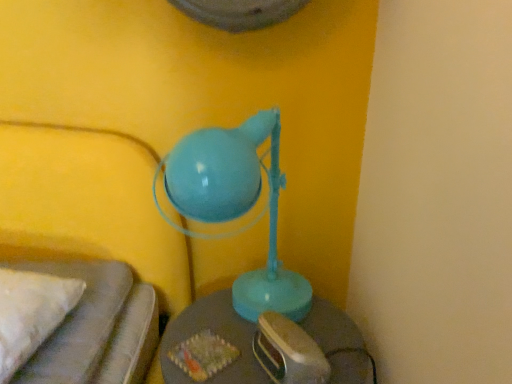
The width and height of the screenshot is (512, 384). Find the location of `matte blue lamp at center`. matte blue lamp at center is located at coordinates (234, 205).

What do you see at coordinates (234, 205) in the screenshot? The width and height of the screenshot is (512, 384). I see `matte blue lamp at center` at bounding box center [234, 205].

Image resolution: width=512 pixels, height=384 pixels. Describe the element at coordinates (211, 345) in the screenshot. I see `matte gray table at center` at that location.

At what (x,y) coordinates should I click in order to perform the action: click on matte gray table at center. Please return your answer as a coordinate pair (x, y). This screenshot has width=512, height=384. Looking at the image, I should click on (211, 345).

At what (x,y) coordinates should I click in order to perform the action: click on matte blue lamp at center. Please return your answer as a coordinate pair (x, y). This screenshot has width=512, height=384. Looking at the image, I should click on (234, 205).

Is matte blue lamp at center to the left of matte gray table at center from the viewer's perspective?

Yes.

Considering their positions, is matte blue lamp at center located in front of or behind matte gray table at center?

In the image, matte blue lamp at center appears in front of matte gray table at center.

Is point (234, 186) positioned before point (361, 382)?

Yes, it is in front of point (361, 382).

From the image's perspective, does matte blue lamp at center appear lower than matte gray table at center?

No.

From a real-world perspective, does matte blue lamp at center sit lower than matte gray table at center?

Actually, matte blue lamp at center is physically above matte gray table at center in the real world.

Consider the image. Is matte blue lamp at center wider than matte gray table at center?

Yes, matte blue lamp at center is wider than matte gray table at center.

Which of these two, matte blue lamp at center or matte gray table at center, stands shorter?

Standing shorter between the two is matte gray table at center.

In terms of size, does matte blue lamp at center appear bigger or smaller than matte gray table at center?

Considering their sizes, matte blue lamp at center takes up more space than matte gray table at center.

Looking at this image, is matte gray table at center located within matte blue lamp at center?

No, matte blue lamp at center does not contain matte gray table at center.

Is matte blue lamp at center far from matte gray table at center?

No, matte blue lamp at center is not far away from matte gray table at center.

Could you tell me if matte blue lamp at center is turned towards matte gray table at center?

No, matte blue lamp at center is not oriented towards matte gray table at center.

How different are the orientations of matte blue lamp at center and matte gray table at center in degrees?

The facing directions of matte blue lamp at center and matte gray table at center are 0.868 degrees apart.

Where is `lamp above the matte gray table at center (from a real-world perspective)`? lamp above the matte gray table at center (from a real-world perspective) is located at coordinates (234, 205).

Between matte gray table at center and matte blue lamp at center, which one appears on the right side from the viewer's perspective?

From the viewer's perspective, matte gray table at center appears more on the right side.

Considering the positions of objects matte gray table at center and matte blue lamp at center in the image provided, who is in front, matte gray table at center or matte blue lamp at center?

Positioned in front is matte blue lamp at center.

Which point is more forward, (220, 319) or (193, 139)?

The point (193, 139) is closer.

Looking at this image, from the image's perspective, between matte gray table at center and matte blue lamp at center, who is located below?

matte gray table at center is shown below in the image.

From a real-world perspective, is matte gray table at center beneath matte blue lamp at center?

Yes, from a real-world perspective, matte gray table at center is under matte blue lamp at center.

Is matte gray table at center thinner than matte blue lamp at center?

Correct, the width of matte gray table at center is less than that of matte blue lamp at center.

Looking at this image, is matte gray table at center taller than matte blue lamp at center?

Incorrect, the height of matte gray table at center is not larger of that of matte blue lamp at center.

In the scene shown: Is matte gray table at center smaller than matte blue lamp at center?

Yes, matte gray table at center is smaller than matte blue lamp at center.

Choose the correct answer: Is matte gray table at center inside matte blue lamp at center or outside it?

matte gray table at center cannot be found inside matte blue lamp at center.

Is matte gray table at center beside matte blue lamp at center?

There is a gap between matte gray table at center and matte blue lamp at center.

Does matte gray table at center turn towards matte blue lamp at center?

No, matte gray table at center is not oriented towards matte blue lamp at center.

Can you tell me how much matte gray table at center and matte blue lamp at center differ in facing direction?

They differ by 0.868 degrees in their facing directions.

Measure the distance from matte gray table at center to matte blue lamp at center.

14.73 centimeters.

Identify the location of table below the matte blue lamp at center (from a real-world perspective). (211, 345).

Find the location of a particular element. The image size is (512, 384). lamp to the left of matte gray table at center is located at coordinates (234, 205).

Where is `table behind the matte blue lamp at center`? This screenshot has width=512, height=384. table behind the matte blue lamp at center is located at coordinates point(211,345).